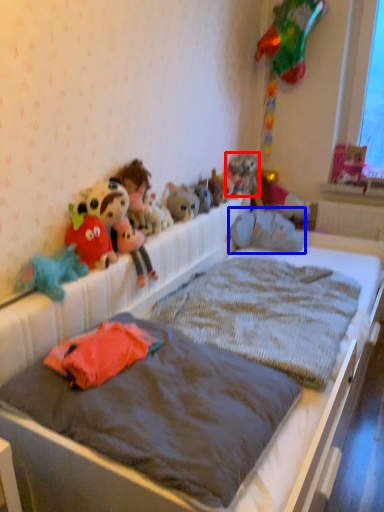
Question: Which object appears closest to the camera in this image, toy (highlighted by a red box) or toy (highlighted by a blue box)?

Choices:
 (A) toy
 (B) toy

Answer: (B)